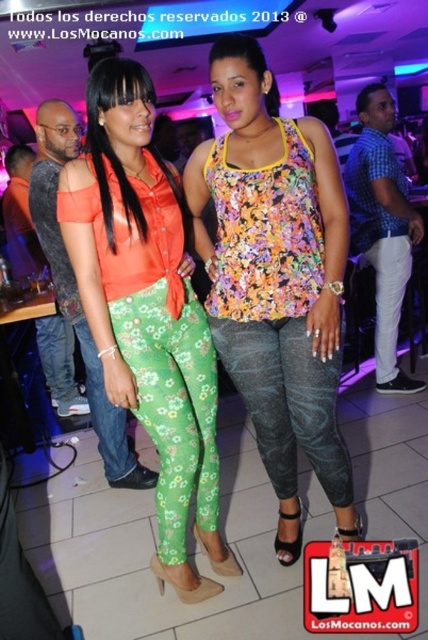
You are at a party and need to decide which pair of pants to wear based on their size. The green floral pants at center and the white cotton pants at right are available. Which pair is larger?

The green floral pants at center is bigger than the white cotton pants at right, so the green floral pants at center is the larger option.

Based on the photo, you are at a party and want to take a photo with the metallic textured leggings at center and the green floral leggings at lower left. Which pair of leggings is closer to the camera?

The metallic textured leggings at center is closer to the viewer than the green floral leggings at lower left, so it appears closer to the camera.

You are a photographer at the party and want to capture a closeup shot of the metallic textured leggings at center without the green floral leggings at lower left being visible. Is this possible given their positions?

The metallic textured leggings at center is positioned over green floral leggings at lower left, so it is possible to capture a closeup of the metallic textured leggings at center without the green floral leggings at lower left being visible by focusing on the upper part where the metallic leggings are covering the green ones.